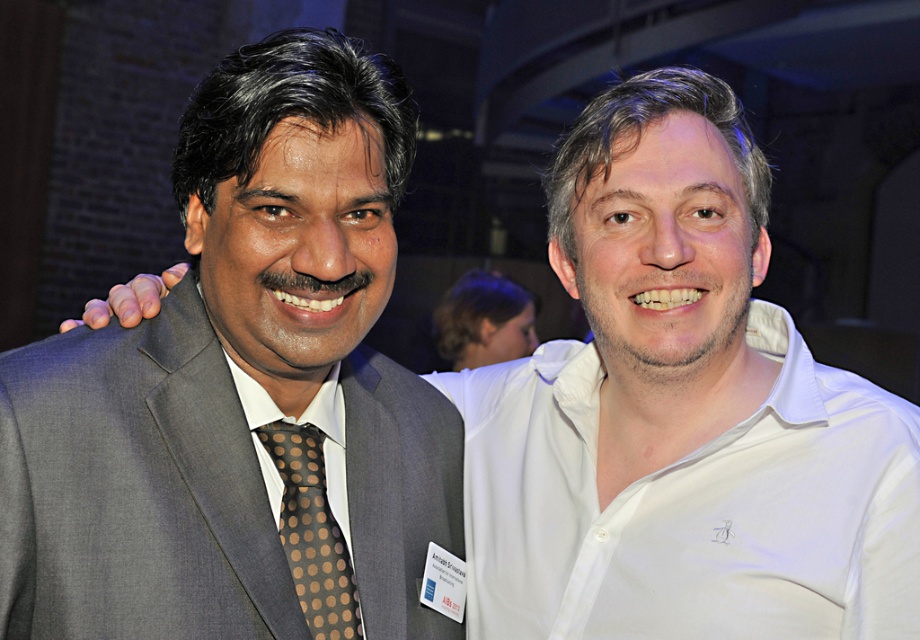
Question: Which of the following is the closest to the observer?

Choices:
 (A) (209, 417)
 (B) (348, 596)

Answer: (A)

Question: Can you confirm if gray fabric suit at left is positioned to the left of brown dotted fabric tie at left?

Choices:
 (A) no
 (B) yes

Answer: (B)

Question: From the image, what is the correct spatial relationship of gray fabric suit at left in relation to brown dotted fabric tie at left?

Choices:
 (A) above
 (B) below

Answer: (A)

Question: Is gray fabric suit at left behind brown dotted fabric tie at left?

Choices:
 (A) yes
 (B) no

Answer: (B)